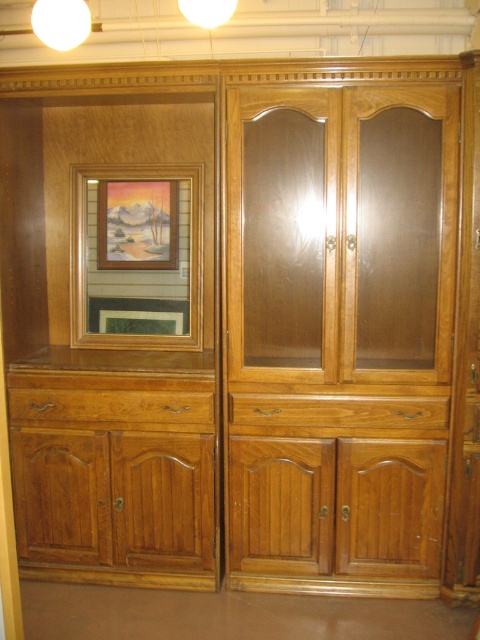
Question: Which of the following is the farthest from the observer?

Choices:
 (A) (231, 296)
 (B) (375, 420)
 (C) (105, 419)

Answer: (C)

Question: Which point is closer to the camera?

Choices:
 (A) (199, 284)
 (B) (197, 422)
 (C) (248, 444)
 (D) (457, 113)

Answer: (D)

Question: Is light brown wood armoire at center thinner than matte wooden picture frame at upper left?

Choices:
 (A) yes
 (B) no

Answer: (B)

Question: In this image, where is light brown wood armoire at center located relative to gold-framed picture at upper left?

Choices:
 (A) above
 (B) below

Answer: (B)

Question: From the image, what is the correct spatial relationship of transparent wood cabinet doors at center in relation to matte wooden picture frame at upper left?

Choices:
 (A) right
 (B) left

Answer: (A)

Question: Which object is the closest to the matte wooden picture frame at upper left?

Choices:
 (A) gold-framed picture at upper left
 (B) transparent wood cabinet doors at center
 (C) light brown wood drawer at lower left
 (D) light brown wood armoire at center

Answer: (A)